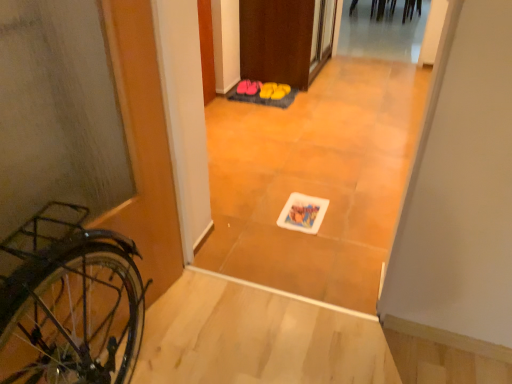
Question: Is matte black bicycle at left smaller than pink fabric slippers at center, the third footwear viewed from the right?

Choices:
 (A) no
 (B) yes

Answer: (A)

Question: Is matte black bicycle at left wider than pink fabric slippers at center, the third footwear viewed from the right?

Choices:
 (A) no
 (B) yes

Answer: (B)

Question: Can pink fabric slippers at center, the third footwear viewed from the right, be found inside matte black bicycle at left?

Choices:
 (A) no
 (B) yes

Answer: (A)

Question: Is matte black bicycle at left next to pink fabric slippers at center, arranged as the 3th footwear when viewed from the left, and touching it?

Choices:
 (A) yes
 (B) no

Answer: (B)

Question: Is matte black bicycle at left aimed at pink fabric slippers at center, the third footwear viewed from the right?

Choices:
 (A) no
 (B) yes

Answer: (A)

Question: From the image's perspective, is matte black bicycle at left on pink fabric slippers at center, arranged as the 3th footwear when viewed from the left?

Choices:
 (A) yes
 (B) no

Answer: (B)

Question: From a real-world perspective, is matte black bicycle at left positioned under yellow rubber boots at center, marked as the 1th footwear in a right-to-left arrangement, based on gravity?

Choices:
 (A) yes
 (B) no

Answer: (B)

Question: Considering the relative positions of matte black bicycle at left and yellow rubber boots at center, marked as the 1th footwear in a right-to-left arrangement, in the image provided, is matte black bicycle at left to the left of yellow rubber boots at center, marked as the 1th footwear in a right-to-left arrangement, from the viewer's perspective?

Choices:
 (A) yes
 (B) no

Answer: (A)

Question: Can you confirm if matte black bicycle at left is wider than yellow rubber boots at center, arranged as the 5th footwear when viewed from the left?

Choices:
 (A) no
 (B) yes

Answer: (B)

Question: Is matte black bicycle at left bigger than yellow rubber boots at center, marked as the 1th footwear in a right-to-left arrangement?

Choices:
 (A) yes
 (B) no

Answer: (A)

Question: From a real-world perspective, does matte black bicycle at left stand above yellow rubber boots at center, marked as the 1th footwear in a right-to-left arrangement?

Choices:
 (A) no
 (B) yes

Answer: (B)

Question: Is matte black bicycle at left with yellow rubber boots at center, marked as the 1th footwear in a right-to-left arrangement?

Choices:
 (A) yes
 (B) no

Answer: (B)

Question: From the image's perspective, does yellow rubber boots at center, marked as the 1th footwear in a right-to-left arrangement, appear lower than pink fabric slippers at center, the third footwear viewed from the right?

Choices:
 (A) yes
 (B) no

Answer: (B)